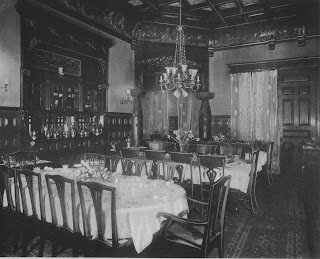
Locate an element on the screen. The height and width of the screenshot is (259, 320). curtain is located at coordinates (268, 110).